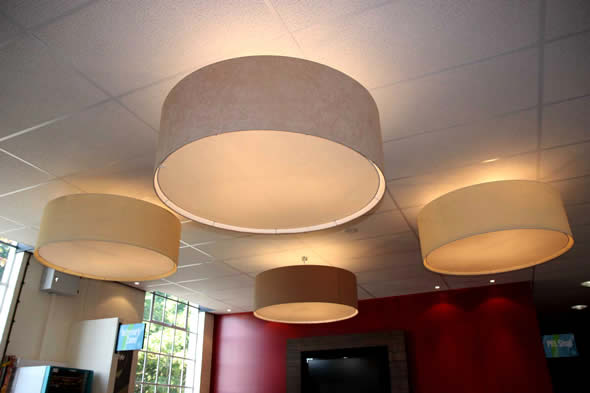
The height and width of the screenshot is (393, 590). Identify the location of tv. (360, 371).